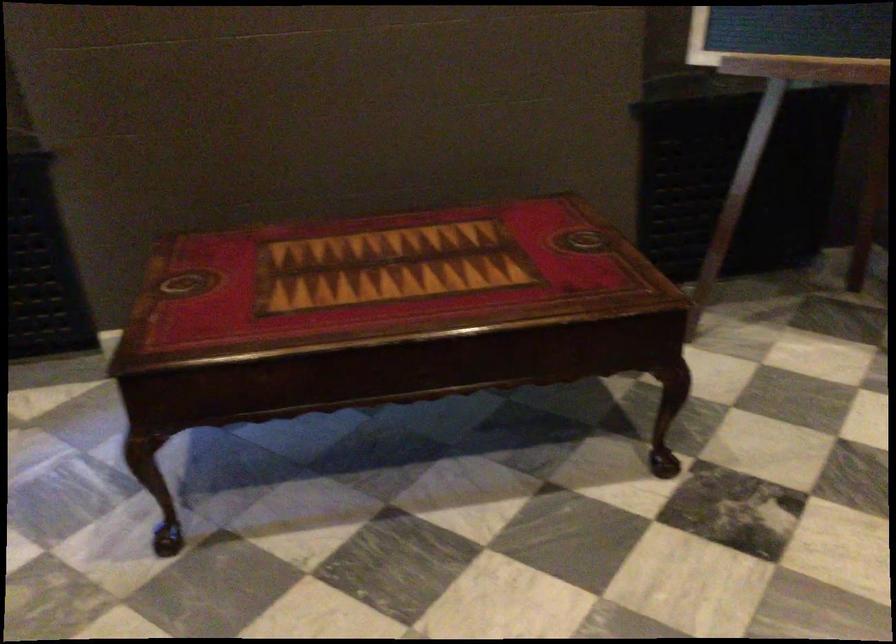
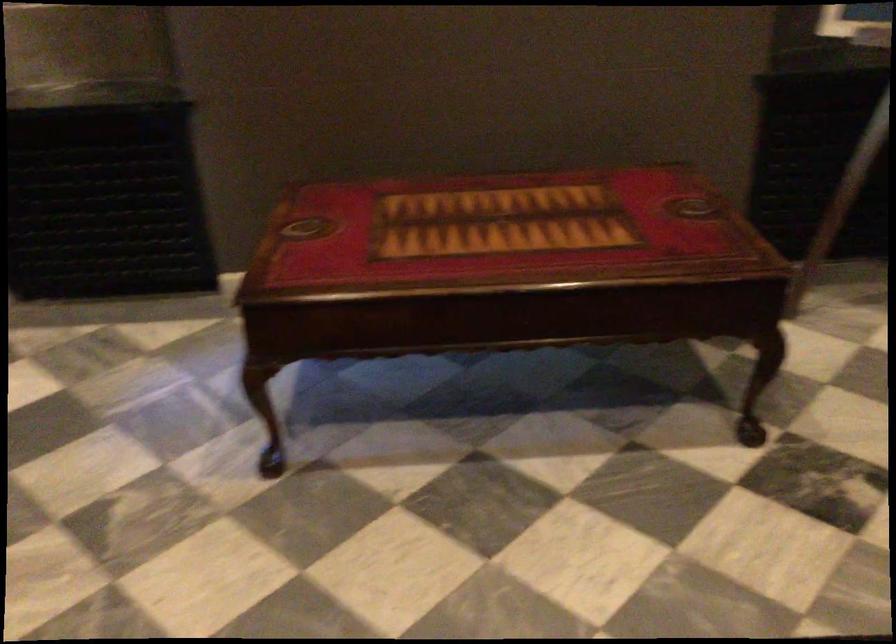
Question: The first image is from the beginning of the video and the second image is from the end. How did the camera likely rotate when shooting the video?

Choices:
 (A) Left
 (B) Right
 (C) Up
 (D) Down

Answer: (A)